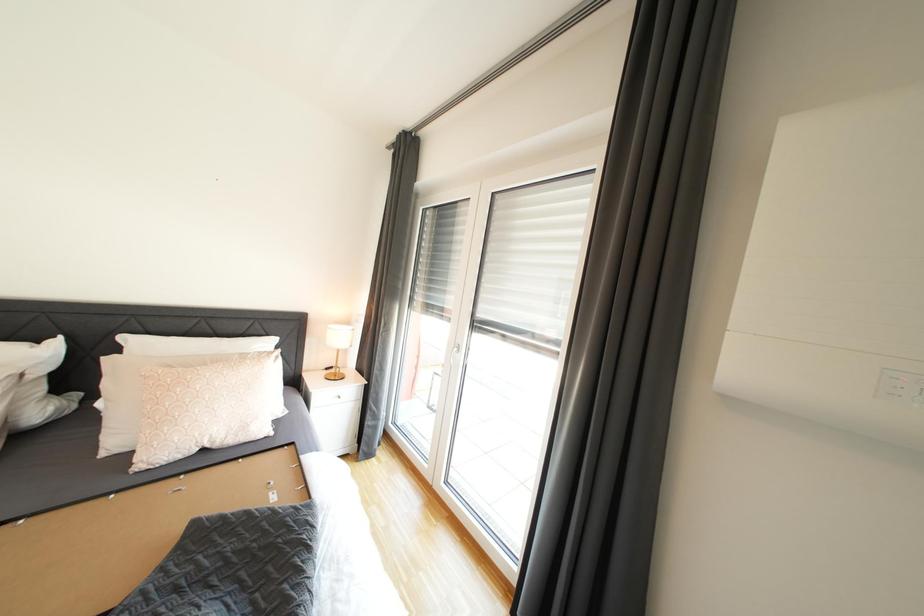
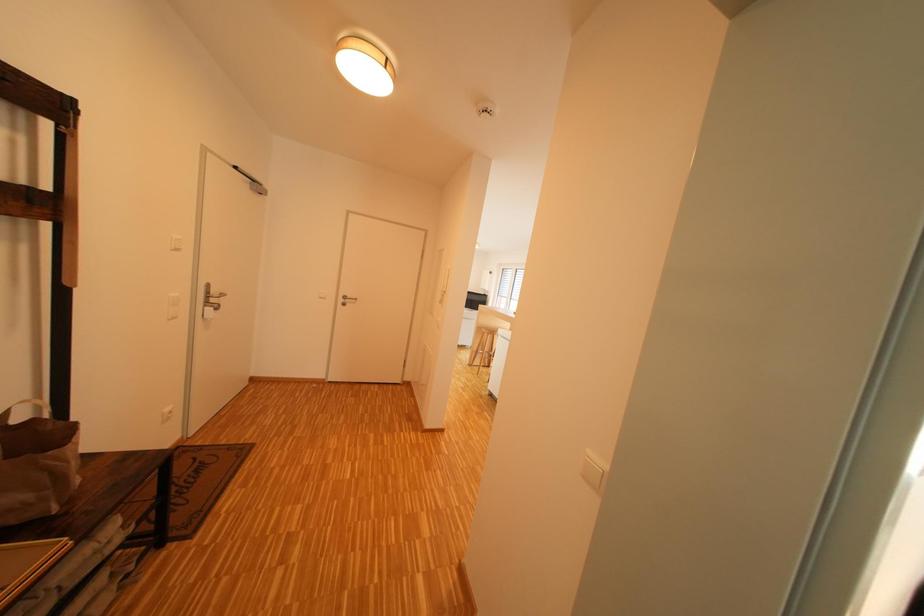
Question: The images are taken continuously from a first-person perspective. In which direction are you moving?

Choices:
 (A) Left
 (B) Right
 (C) Forward
 (D) Backward

Answer: (A)